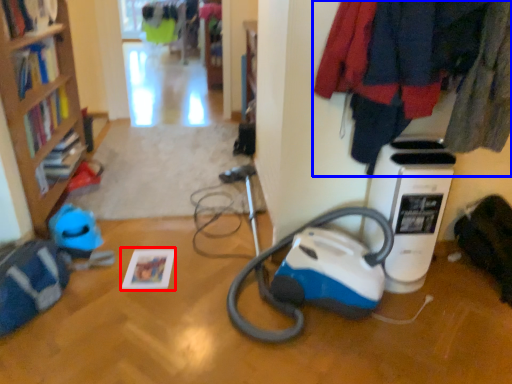
Question: Which object appears closest to the camera in this image, book (highlighted by a red box) or clothing (highlighted by a blue box)?

Choices:
 (A) book
 (B) clothing

Answer: (B)